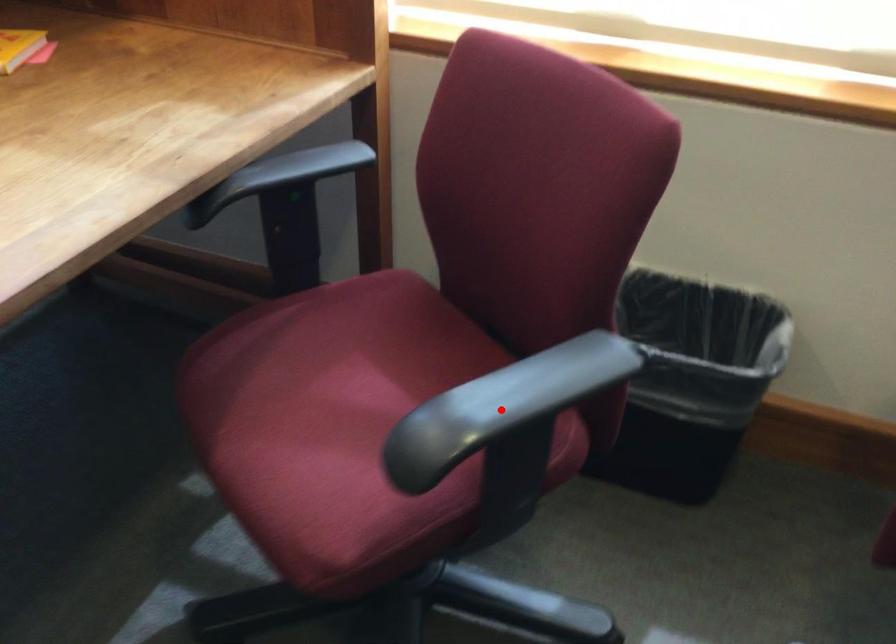
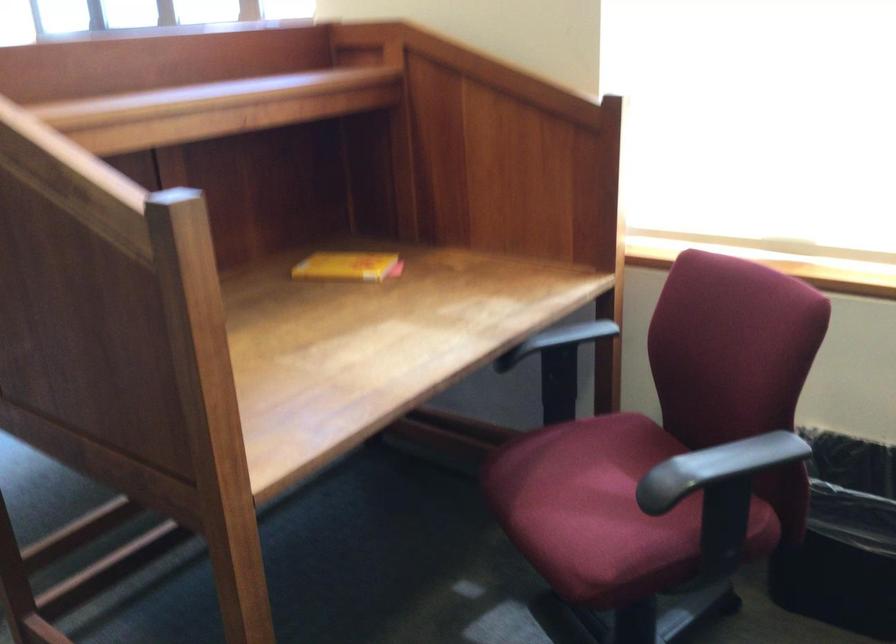
Question: I am providing you with two images of the same scene from different viewpoints. Image1 has a red point marked. In image2, the corresponding 3D location appears at what relative position? Reply with the corresponding letter.

Choices:
 (A) Closer
 (B) Farther

Answer: (B)